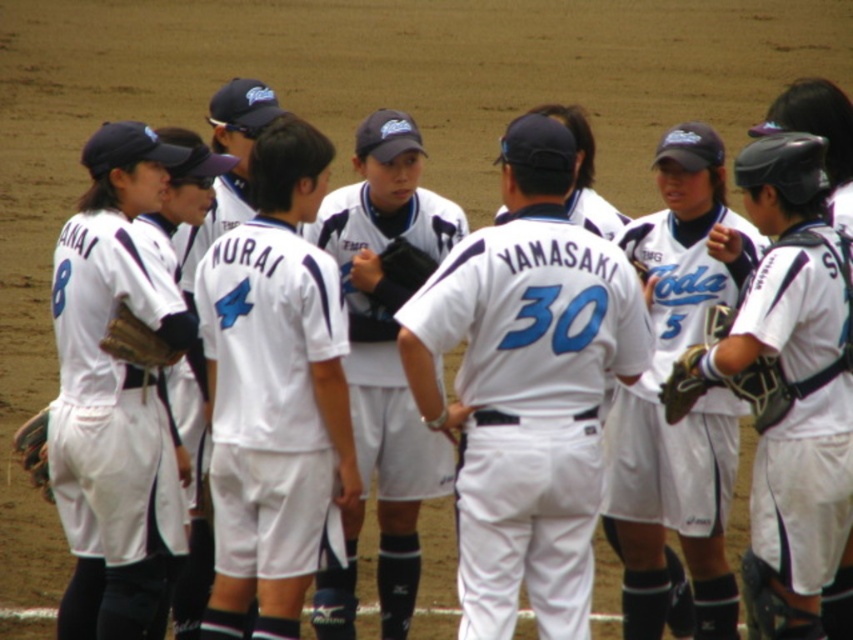
Question: Does white matte jersey at center have a smaller size compared to brown leather glove at left?

Choices:
 (A) no
 (B) yes

Answer: (A)

Question: Among these points, which one is farthest from the camera?

Choices:
 (A) (831, 477)
 (B) (122, 228)

Answer: (B)

Question: Is white matte jersey at center thinner than brown leather glove at lower right?

Choices:
 (A) no
 (B) yes

Answer: (A)

Question: From the image, what is the correct spatial relationship of white matte uniform at center in relation to brown leather glove at lower right?

Choices:
 (A) below
 (B) above

Answer: (A)

Question: Which point is closer to the camera?

Choices:
 (A) white matte jersey at center
 (B) white matte baseball uniform at center

Answer: (B)

Question: Which object is the farthest from the black leather glove at center?

Choices:
 (A) white matte jersey at center
 (B) white matte baseball uniform at center
 (C) white matte baseball uniform at center-right

Answer: (C)